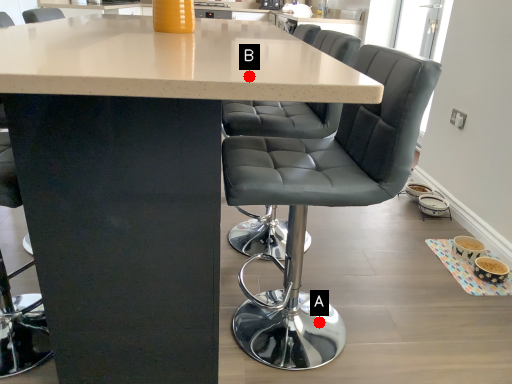
Question: Two points are circled on the image, labeled by A and B beside each circle. Which point is further to the camera?

Choices:
 (A) A is further
 (B) B is further

Answer: (A)